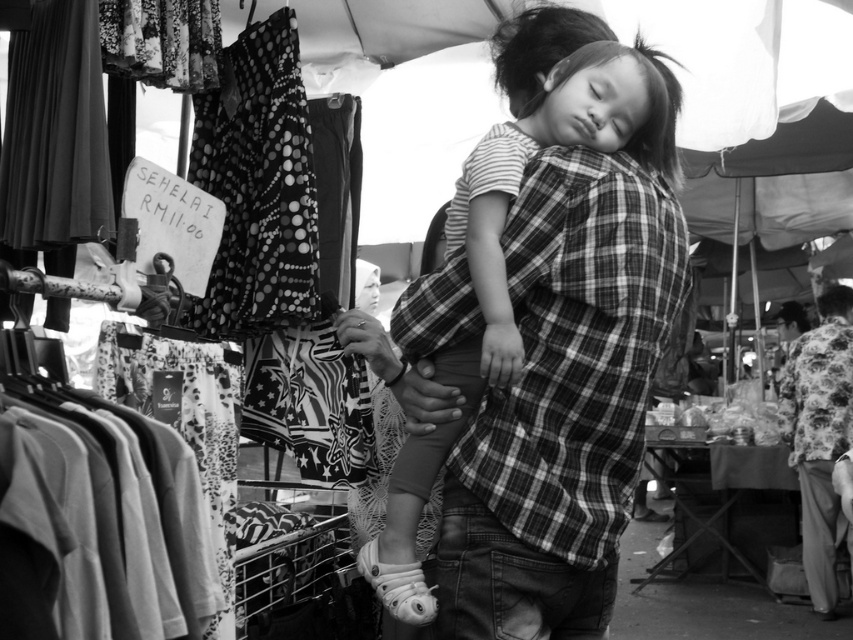
Can you confirm if soft cotton shirt at center is shorter than floral-patterned shirt at right?

Yes.

Who is lower down, soft cotton shirt at center or floral-patterned shirt at right?

floral-patterned shirt at right is below.

Who is more forward, (601, 288) or (819, 404)?

Point (601, 288) is in front.

You are a GUI agent. You are given a task and a screenshot of the screen. Output one action in this format:
    pyautogui.click(x=<x>, y=<y>)
    Task: Click on the soft cotton shirt at center
    This screenshot has width=853, height=640.
    Given the screenshot: What is the action you would take?
    pyautogui.click(x=567, y=380)